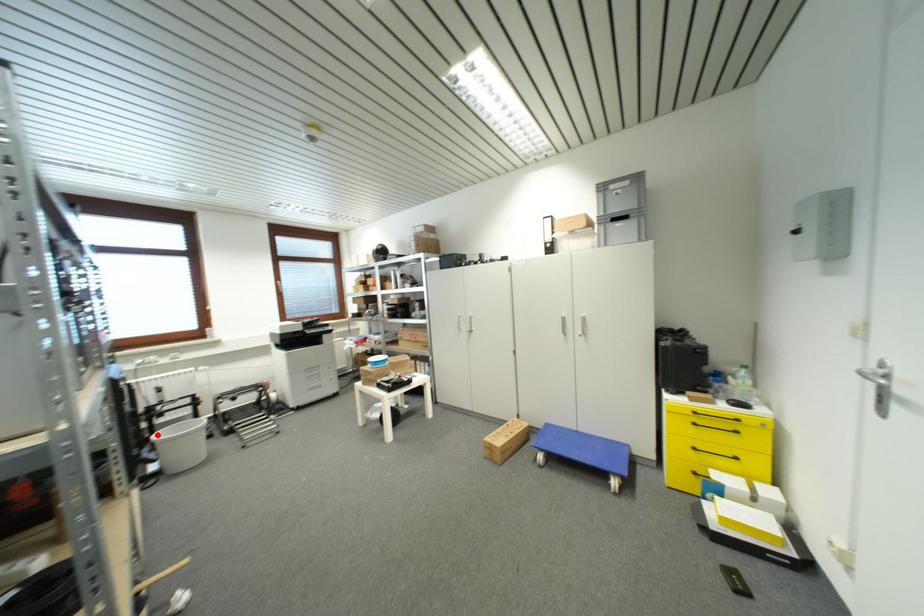
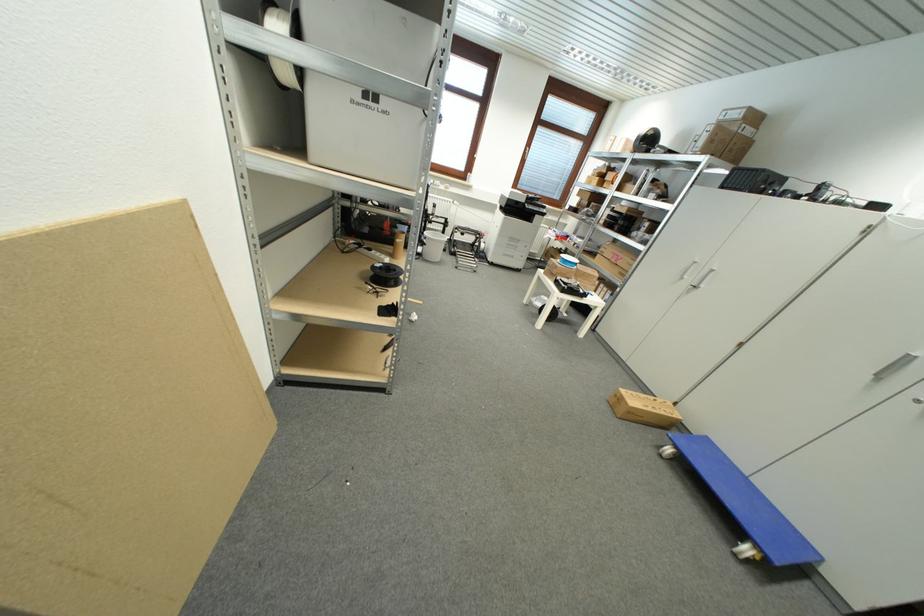
The point at the highlighted location is marked in the first image. Where is the corresponding point in the second image?

(430, 233)